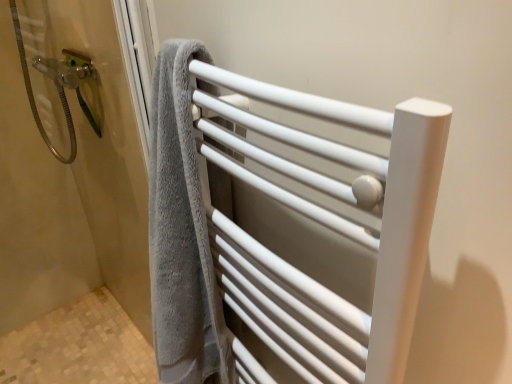
Question: Is the depth of gray towel at left greater than that of white matte towel rack at center?

Choices:
 (A) yes
 (B) no

Answer: (A)

Question: From the image's perspective, does gray towel at left appear higher than white matte towel rack at center?

Choices:
 (A) yes
 (B) no

Answer: (A)

Question: Considering the relative positions of gray towel at left and white matte towel rack at center in the image provided, is gray towel at left in front of white matte towel rack at center?

Choices:
 (A) yes
 (B) no

Answer: (B)

Question: Are gray towel at left and white matte towel rack at center located far from each other?

Choices:
 (A) yes
 (B) no

Answer: (B)

Question: Is gray towel at left shorter than white matte towel rack at center?

Choices:
 (A) no
 (B) yes

Answer: (A)

Question: Considering the relative sizes of gray towel at left and white matte towel rack at center in the image provided, is gray towel at left smaller than white matte towel rack at center?

Choices:
 (A) no
 (B) yes

Answer: (B)

Question: Considering the relative sizes of white matte towel rack at center and gray towel at left in the image provided, is white matte towel rack at center shorter than gray towel at left?

Choices:
 (A) yes
 (B) no

Answer: (A)

Question: Could you tell me if white matte towel rack at center is facing gray towel at left?

Choices:
 (A) yes
 (B) no

Answer: (B)

Question: Is white matte towel rack at center at the left side of gray towel at left?

Choices:
 (A) yes
 (B) no

Answer: (B)

Question: Is white matte towel rack at center facing away from gray towel at left?

Choices:
 (A) yes
 (B) no

Answer: (B)

Question: Does white matte towel rack at center have a larger size compared to gray towel at left?

Choices:
 (A) yes
 (B) no

Answer: (A)

Question: Would you say gray towel at left is part of white matte towel rack at center's contents?

Choices:
 (A) yes
 (B) no

Answer: (B)

Question: Is white matte towel rack at center inside the boundaries of gray towel at left, or outside?

Choices:
 (A) outside
 (B) inside

Answer: (A)